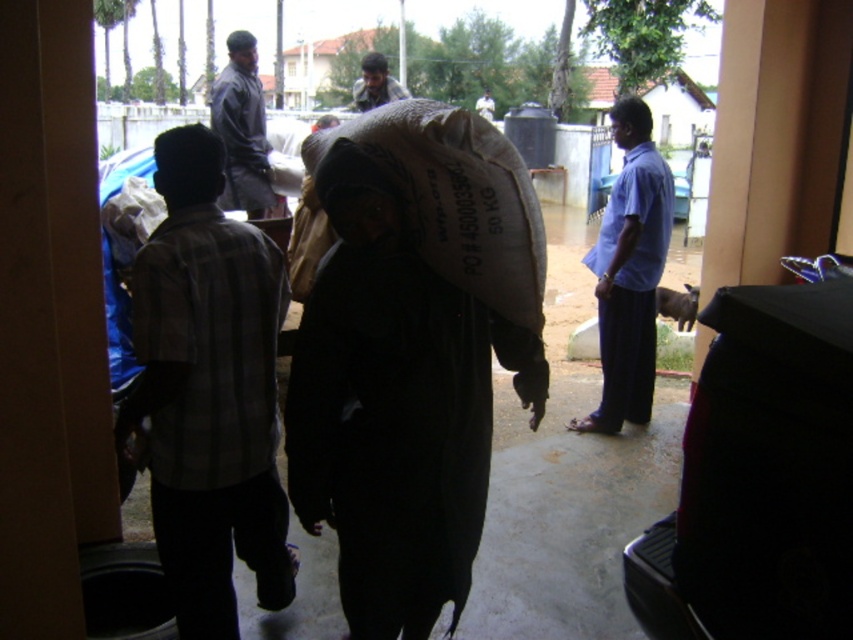
Question: Which point is closer to the camera?

Choices:
 (A) dark matte bag at center
 (B) plaid cotton shirt at center

Answer: (A)

Question: Does dark matte bag at center lie in front of plaid cotton shirt at center?

Choices:
 (A) no
 (B) yes

Answer: (B)

Question: Can you confirm if dark matte bag at center is positioned to the right of blue cotton shirt at right?

Choices:
 (A) no
 (B) yes

Answer: (A)

Question: Does plaid cotton shirt at center appear over dark blue shirt at center?

Choices:
 (A) no
 (B) yes

Answer: (A)

Question: Which of these objects is positioned closest to the dark blue shirt at center?

Choices:
 (A) dark matte bag at center
 (B) blue cotton shirt at right

Answer: (B)

Question: Among these points, which one is farthest from the camera?

Choices:
 (A) (326, 177)
 (B) (368, 83)
 (C) (483, 99)
 (D) (242, 61)

Answer: (C)